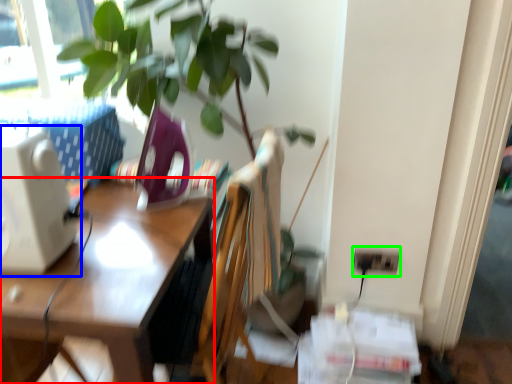
Question: Based on their relative distances, which object is farther from desk (highlighted by a red box)? Choose from desktop computer (highlighted by a blue box) and electric outlet (highlighted by a green box).

Choices:
 (A) desktop computer
 (B) electric outlet

Answer: (B)